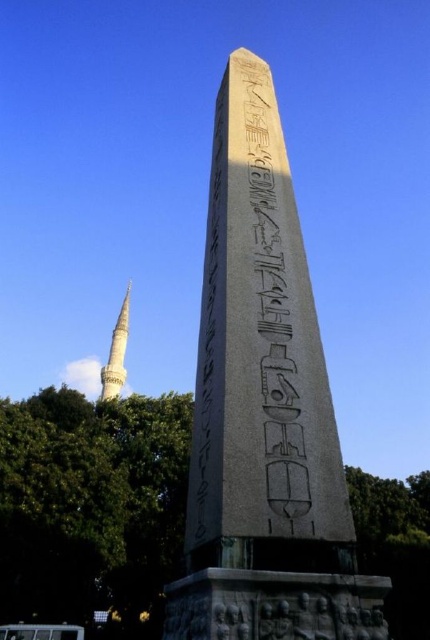
You are standing in front of the Obelisk of Theodosius in Istanbul. You notice two points marked on the image at coordinates point [168,577] and point [215,237]. Which point is closer to your eyes?

Point [168,577] is further to the camera than point [215,237], so the point closer to your eyes is point [215,237].

You are standing at the base of the bronze textured obelisk at center and want to take a photo of it. If your camera has a maximum focus range of 20 feet, will it be able to capture the obelisk clearly?

The bronze textured obelisk at center is 18.42 feet away from the camera, which is within the 20 feet maximum focus range. Therefore, the camera can capture the obelisk clearly.

You are an architect examining the Obelisk of Theodosius and the nearby mosque. From your current vantage point, which object is nearer to you between the black stone hieroglyphs at center and the white glossy minaret at lower left?

The black stone hieroglyphs at center are closer to the viewer than the white glossy minaret at lower left according to the description.